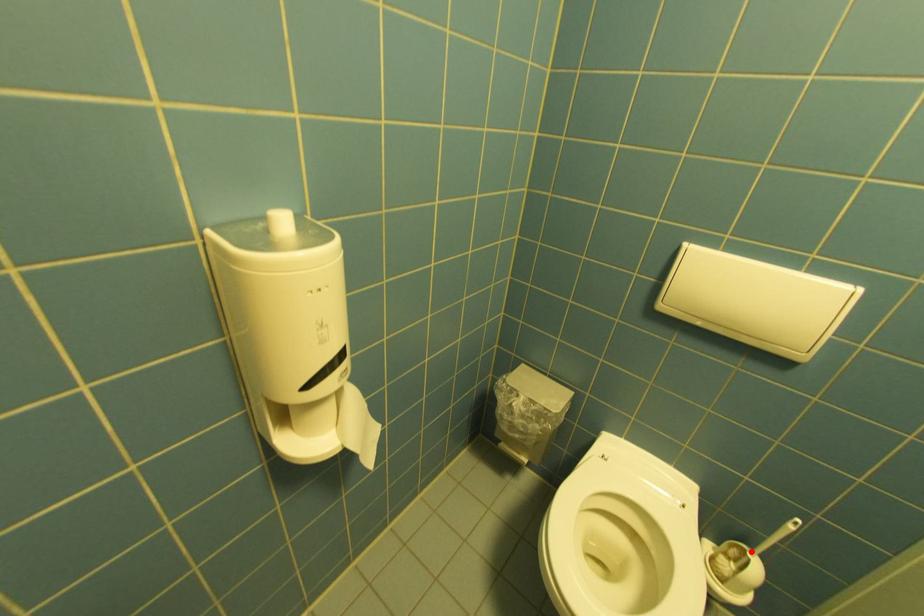
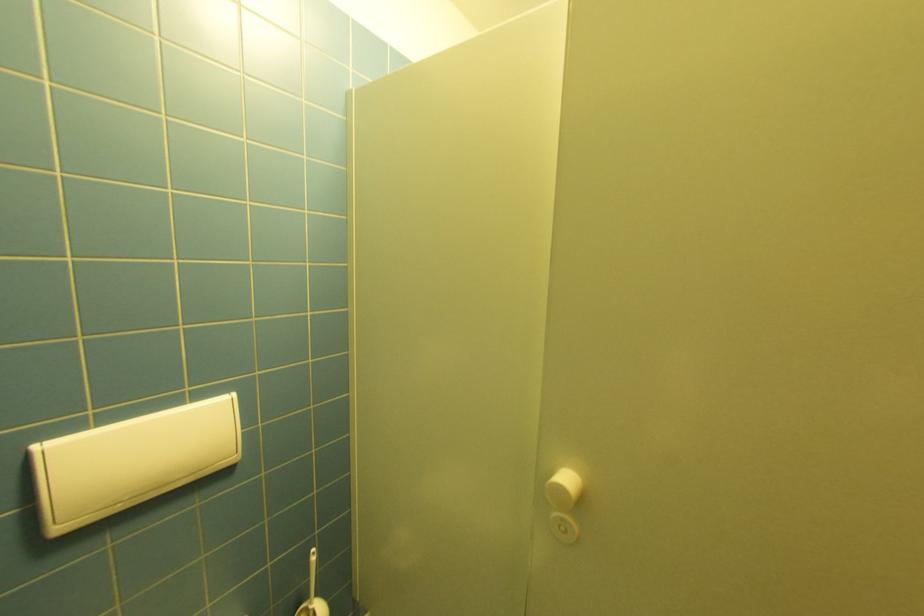
Question: A red point is marked in image1. In image2, is the corresponding 3D point closer to the camera or farther? Reply with the corresponding letter.

Choices:
 (A) The corresponding 3D point is closer.
 (B) The corresponding 3D point is farther.

Answer: (B)